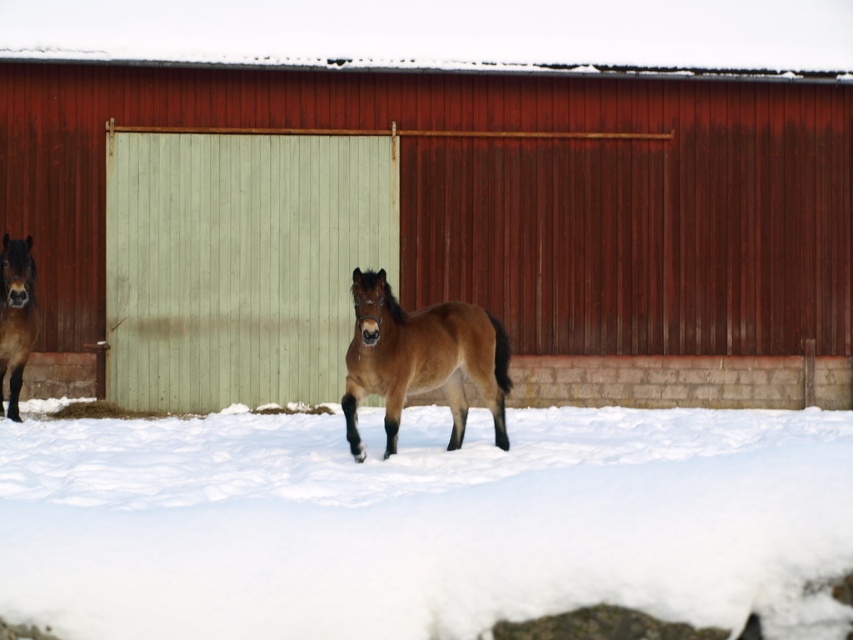
Question: Which of the following is the closest to the observer?

Choices:
 (A) smooth wooden barn at center
 (B) brown glossy horse at left

Answer: (B)

Question: Among these objects, which one is farthest from the camera?

Choices:
 (A) brown glossy horse at center
 (B) smooth wooden barn at center

Answer: (B)

Question: Does smooth wooden barn at center have a larger size compared to green corrugated metal at center?

Choices:
 (A) no
 (B) yes

Answer: (B)

Question: Is white fluffy snow at lower center wider than green corrugated metal at center?

Choices:
 (A) no
 (B) yes

Answer: (B)

Question: Which of the following is the closest to the observer?

Choices:
 (A) brown glossy horse at center
 (B) brown glossy horse at left
 (C) green corrugated metal at center

Answer: (A)

Question: Is green corrugated metal at center thinner than brown glossy horse at left?

Choices:
 (A) no
 (B) yes

Answer: (A)